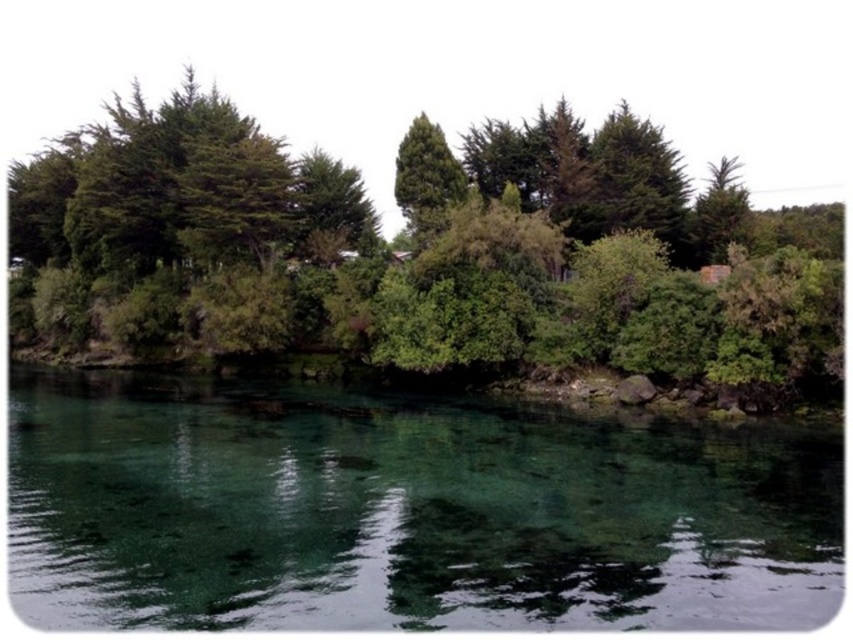
Question: Which point is closer to the camera taking this photo?

Choices:
 (A) (73, 138)
 (B) (460, 195)
 (C) (161, 484)

Answer: (C)

Question: Does clear glass water at center appear on the left side of green leafy tree at center?

Choices:
 (A) yes
 (B) no

Answer: (A)

Question: Estimate the real-world distances between objects in this image. Which object is closer to the clear glass water at center?

Choices:
 (A) green leafy tree at center
 (B) green leafy trees at center

Answer: (B)

Question: Can you confirm if clear glass water at center is thinner than green leafy trees at center?

Choices:
 (A) yes
 (B) no

Answer: (A)

Question: Considering the real-world distances, which object is closest to the green leafy trees at center?

Choices:
 (A) clear glass water at center
 (B) green leafy tree at center

Answer: (B)

Question: Is clear glass water at center positioned before green leafy trees at center?

Choices:
 (A) yes
 (B) no

Answer: (A)